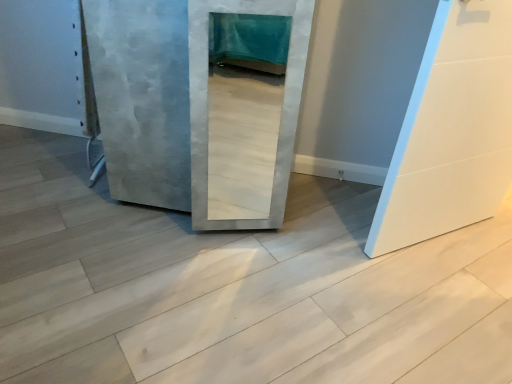
You are a GUI agent. You are given a task and a screenshot of the screen. Output one action in this format:
    pyautogui.click(x=<x>, y=<y>)
    Task: Click on the unoccupied area in front of concrete textured door at center, which is counted as the first door, starting from the left
    
    Given the screenshot: What is the action you would take?
    pyautogui.click(x=159, y=312)